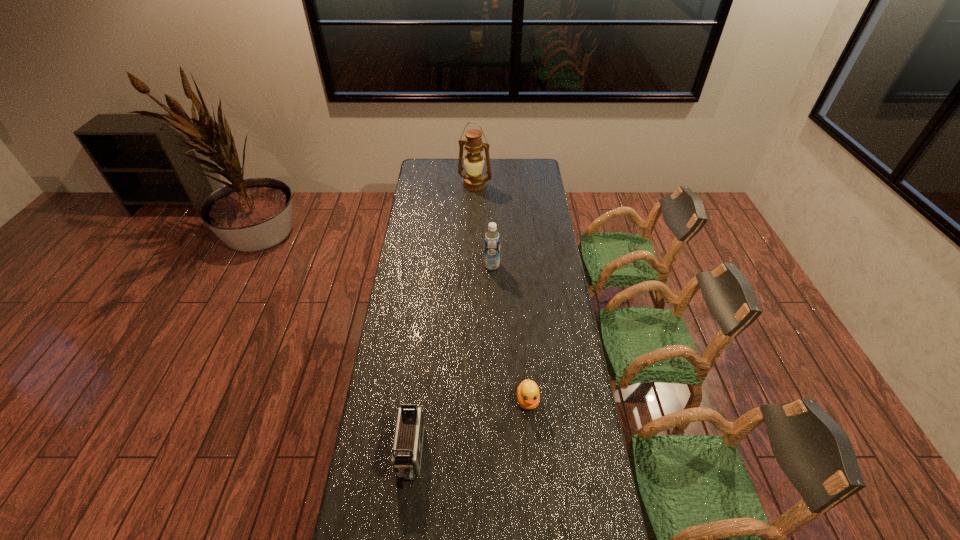
Locate an element on the screen. free spot between the duckling and the soya milk is located at coordinates (510, 333).

The height and width of the screenshot is (540, 960). In order to click on unoccupied area between the rightmost object and the soya milk in this screenshot , I will do `click(510, 333)`.

At what (x,y) coordinates should I click in order to perform the action: click on vacant area that lies between the leftmost object and the shortest object. Please return your answer as a coordinate pair (x, y). The image size is (960, 540). Looking at the image, I should click on (468, 427).

In order to click on blank region between the third nearest object and the second nearest object in this screenshot , I will do `click(510, 333)`.

Find the location of `free point between the leftmost object and the shortest object`. free point between the leftmost object and the shortest object is located at coordinates (468, 427).

Identify which object is located as the third nearest to the leftmost object. Please provide its 2D coordinates. Your answer should be formatted as a tuple, i.e. [(x, y)], where the tuple contains the x and y coordinates of a point satisfying the conditions above.

[(474, 181)]

This screenshot has width=960, height=540. I want to click on object that is the second closest to the second shortest object, so click(491, 238).

The image size is (960, 540). What are the coordinates of `free spot that satisfies the following two spatial constraints: 1. on the label of the soya milk; 2. at the lens of the nearest object` in the screenshot? It's located at (496, 455).

Locate an element on the screen. Image resolution: width=960 pixels, height=540 pixels. free space that satisfies the following two spatial constraints: 1. on the label of the third shortest object; 2. at the lens of the second shortest object is located at coordinates (496, 455).